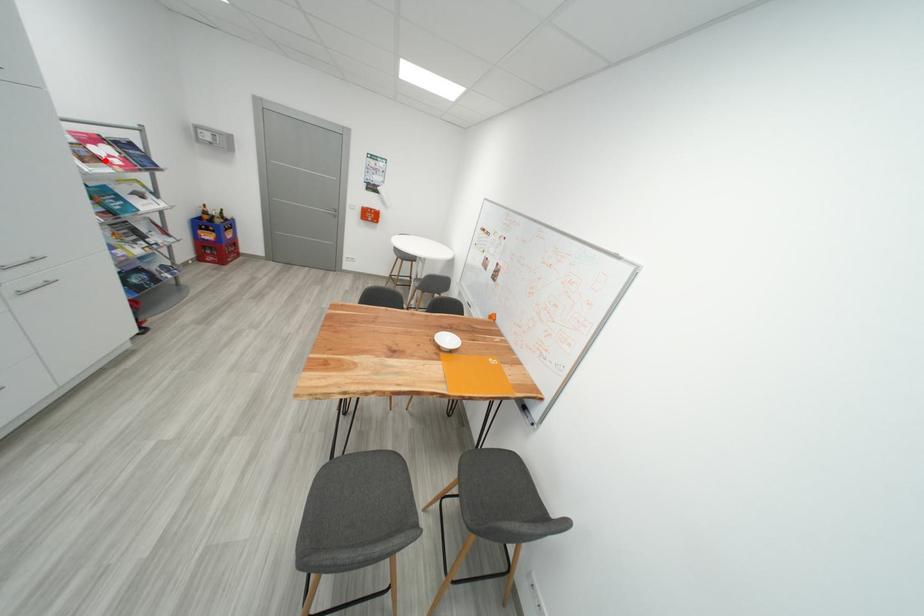
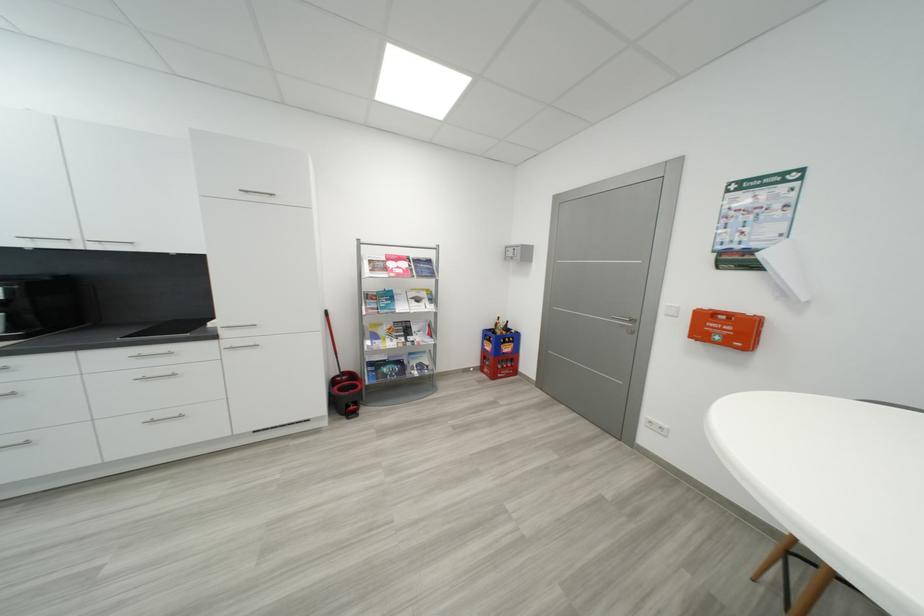
Question: I am providing you with two images of the same scene from different viewpoints. A red point is marked on the first image. At the location where the point appears in image 1, is it still visible in image 2?

Choices:
 (A) Yes
 (B) No

Answer: (A)